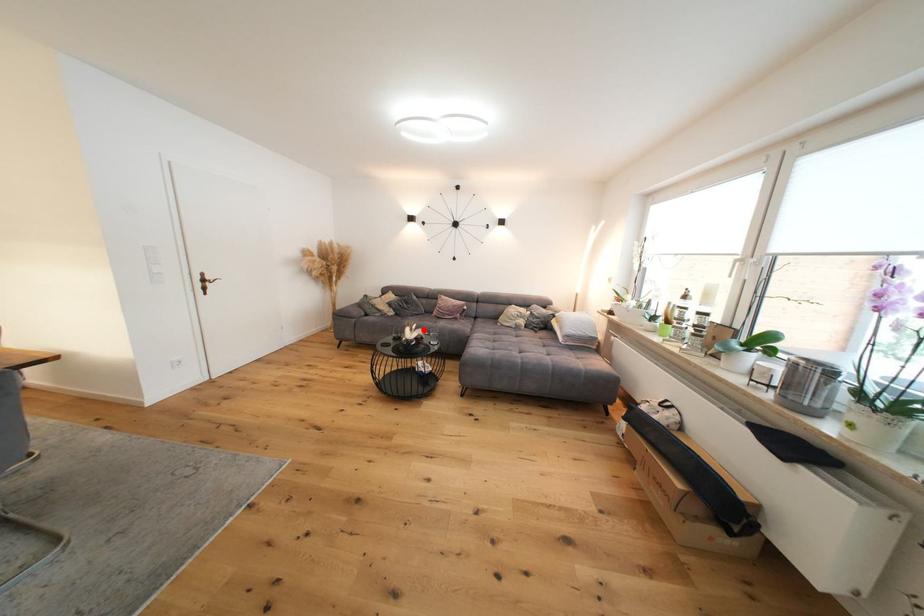
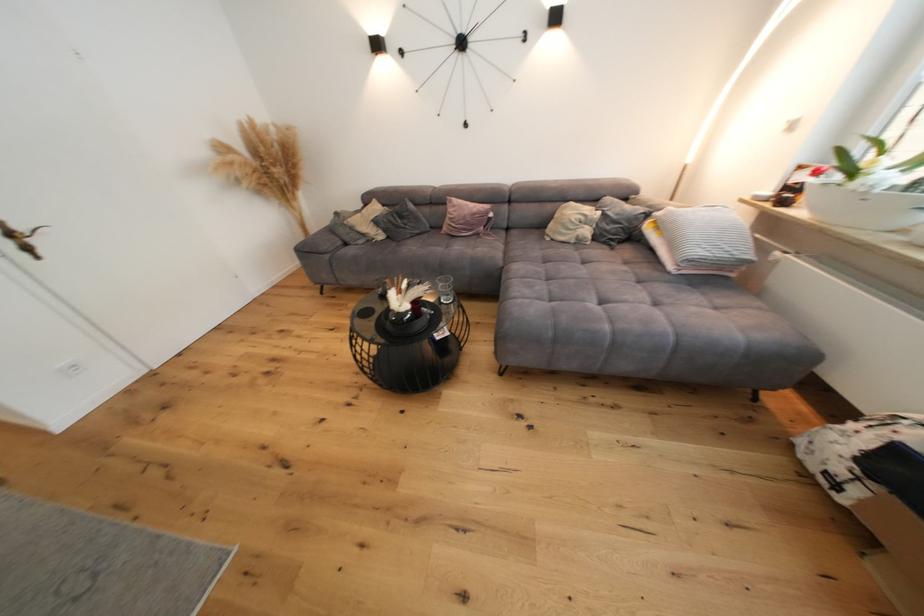
Locate, in the second image, the point that corresponds to the highlighted location in the first image.

(417, 288)